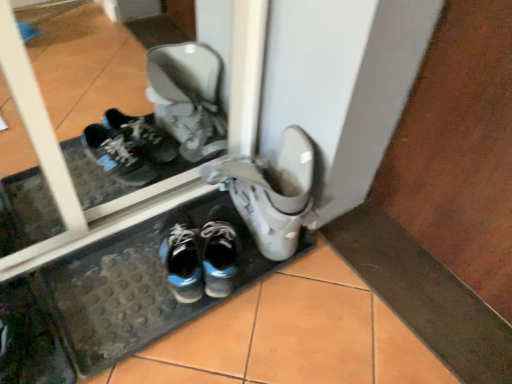
Question: Is blue synthetic sneakers at center, positioned as the 2th footwear in right-to-left order, smaller than shiny blue running shoe at center?

Choices:
 (A) no
 (B) yes

Answer: (A)

Question: Is blue synthetic sneakers at center, positioned as the 2th footwear in right-to-left order, facing towards shiny blue running shoe at center?

Choices:
 (A) yes
 (B) no

Answer: (B)

Question: From the image's perspective, is blue synthetic sneakers at center, positioned as the 2th footwear in right-to-left order, over shiny blue running shoe at center?

Choices:
 (A) yes
 (B) no

Answer: (A)

Question: Is blue synthetic sneakers at center, positioned as the 2th footwear in right-to-left order, positioned with its back to shiny blue running shoe at center?

Choices:
 (A) yes
 (B) no

Answer: (B)

Question: Is blue synthetic sneakers at center, positioned as the 2th footwear in right-to-left order, in contact with shiny blue running shoe at center?

Choices:
 (A) no
 (B) yes

Answer: (B)

Question: Choose the correct answer: Is blue synthetic sneakers at center, positioned as the 2th footwear in right-to-left order, inside white matte boot at center, which is counted as the first footwear, starting from the right, or outside it?

Choices:
 (A) inside
 (B) outside

Answer: (B)

Question: From a real-world perspective, is blue synthetic sneakers at center, positioned as the 2th footwear in right-to-left order, above or below white matte boot at center, which is counted as the first footwear, starting from the right?

Choices:
 (A) above
 (B) below

Answer: (B)

Question: Considering the relative positions of blue synthetic sneakers at center, positioned as the 2th footwear in right-to-left order, and white matte boot at center, which is counted as the first footwear, starting from the right, in the image provided, is blue synthetic sneakers at center, positioned as the 2th footwear in right-to-left order, to the left or to the right of white matte boot at center, which is counted as the first footwear, starting from the right,?

Choices:
 (A) left
 (B) right

Answer: (A)

Question: Is blue synthetic sneakers at center, which is counted as the first footwear, starting from the left, taller or shorter than white matte boot at center, which is counted as the first footwear, starting from the right?

Choices:
 (A) tall
 (B) short

Answer: (B)

Question: Looking at the image, does white matte boot at center, which is counted as the first footwear, starting from the right, seem bigger or smaller compared to shiny blue running shoe at center?

Choices:
 (A) big
 (B) small

Answer: (A)

Question: Is white matte boot at center, which is counted as the first footwear, starting from the right, spatially inside shiny blue running shoe at center, or outside of it?

Choices:
 (A) outside
 (B) inside

Answer: (A)

Question: Is white matte boot at center, which is counted as the first footwear, starting from the right, taller or shorter than shiny blue running shoe at center?

Choices:
 (A) short
 (B) tall

Answer: (B)

Question: In the image, is white matte boot at center, the 2th footwear viewed from the left, positioned in front of or behind shiny blue running shoe at center?

Choices:
 (A) behind
 (B) front

Answer: (B)

Question: Considering the positions of blue synthetic sneakers at center, positioned as the 2th footwear in right-to-left order, and shiny blue running shoe at center in the image, is blue synthetic sneakers at center, positioned as the 2th footwear in right-to-left order, bigger or smaller than shiny blue running shoe at center?

Choices:
 (A) big
 (B) small

Answer: (A)

Question: Visually, is blue synthetic sneakers at center, positioned as the 2th footwear in right-to-left order, positioned to the left or to the right of shiny blue running shoe at center?

Choices:
 (A) left
 (B) right

Answer: (B)